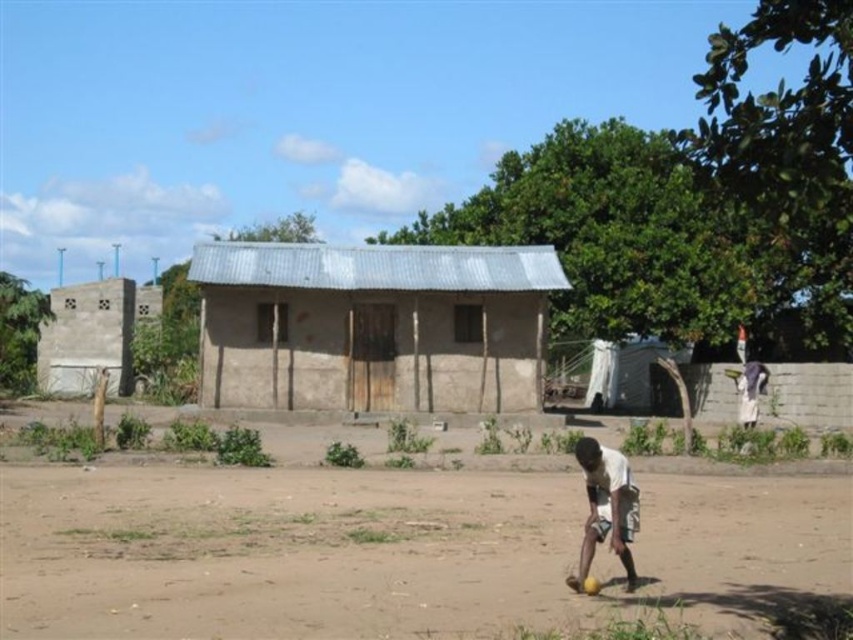
You are standing at the center of the image and want to go to the brown mud hut at center. Which direction should you move?

Since the brown mud hut at center is already at the center of the image, you are already at the correct location.